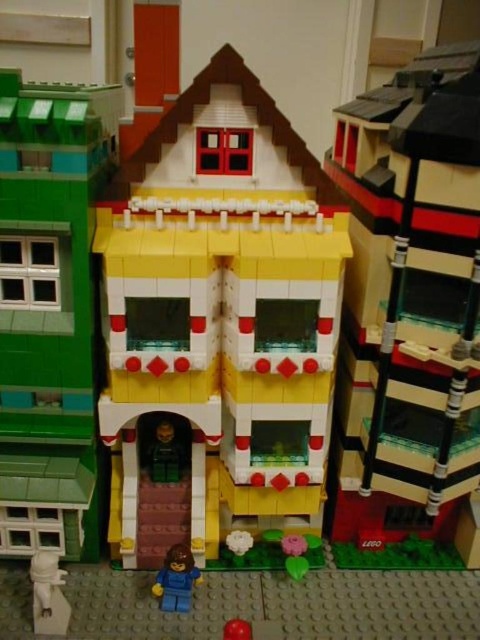
Question: Is yellow matte house at center above translucent plastic window at center?

Choices:
 (A) yes
 (B) no

Answer: (B)

Question: Considering the relative positions of white plastic minifigure at lower left and blue plastic minifigure at lower center in the image provided, where is white plastic minifigure at lower left located with respect to blue plastic minifigure at lower center?

Choices:
 (A) below
 (B) above

Answer: (A)

Question: Among these points, which one is nearest to the camera?

Choices:
 (A) (90, 525)
 (B) (54, 600)
 (C) (170, 560)
 (D) (451, 93)

Answer: (D)

Question: Does green matte building at left appear over white plastic minifigure at lower left?

Choices:
 (A) no
 (B) yes

Answer: (B)

Question: Which point appears farthest from the camera in this image?

Choices:
 (A) (44, 376)
 (B) (434, 323)

Answer: (A)

Question: Which object is positioned farthest from the green matte building at left?

Choices:
 (A) white plastic minifigure at lower left
 (B) blue plastic minifigure at lower center
 (C) smooth red ball at lower center

Answer: (C)